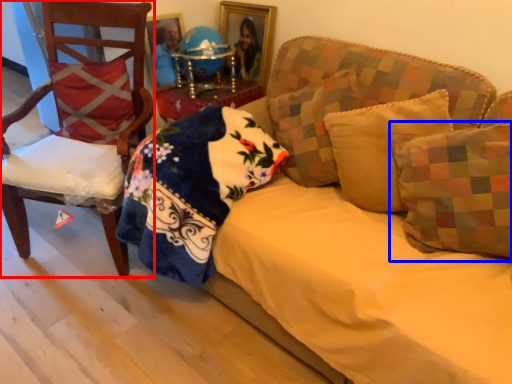
Question: Which object appears closest to the camera in this image, chair (highlighted by a red box) or pillow (highlighted by a blue box)?

Choices:
 (A) chair
 (B) pillow

Answer: (B)